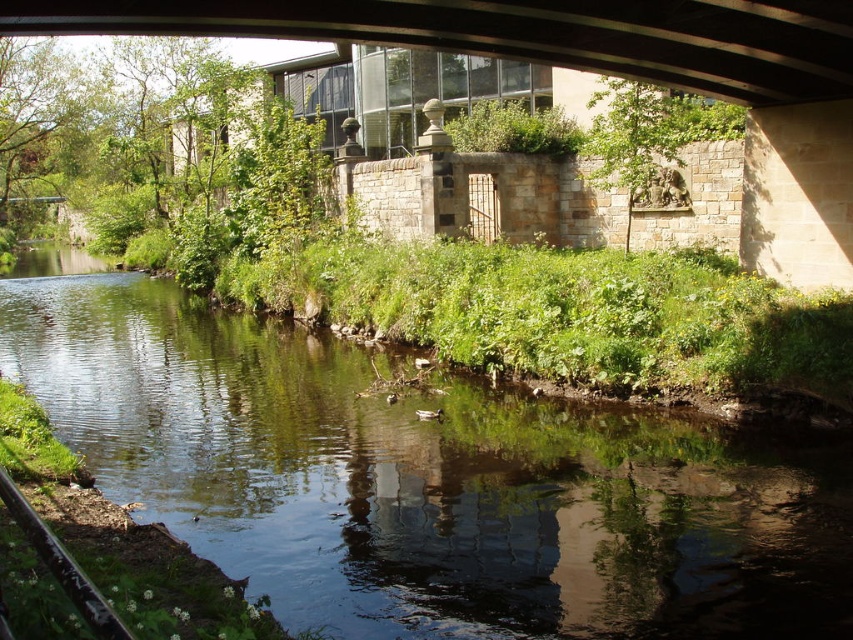
Is green grassy water at lower left smaller than glassy concrete bridge at upper center?

No, green grassy water at lower left is not smaller than glassy concrete bridge at upper center.

Is point (405, 461) farther from viewer compared to point (712, 4)?

Yes, it is.

Image resolution: width=853 pixels, height=640 pixels. Find the location of `green grassy water at lower left`. green grassy water at lower left is located at coordinates (425, 480).